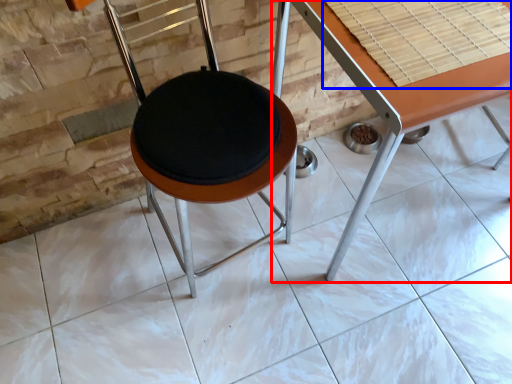
Question: Among these objects, which one is farthest to the camera, table (highlighted by a red box) or table top (highlighted by a blue box)?

Choices:
 (A) table
 (B) table top

Answer: (B)